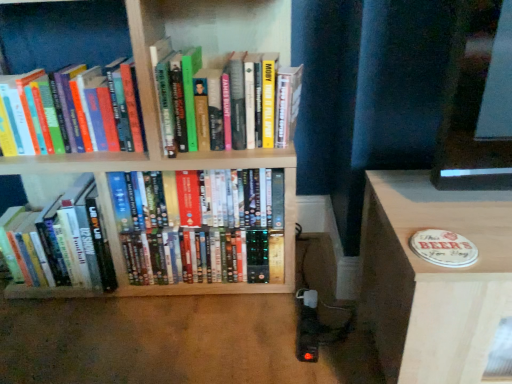
In order to face wooden bookshelf at center, should I rotate leftwards or rightwards?

It's best to rotate left around 14.934 degrees.

Identify the location of wooden coaster at lower right. Image resolution: width=512 pixels, height=384 pixels. (433, 278).

Measure the distance between hardcover books at center, acting as the fourth book starting from the left, and camera.

hardcover books at center, acting as the fourth book starting from the left, is 3.35 feet from camera.

Describe the element at coordinates (60, 242) in the screenshot. Image resolution: width=512 pixels, height=384 pixels. I see `hardcover books at left, acting as the 4th book starting from the right` at that location.

Locate an element on the screen. Image resolution: width=512 pixels, height=384 pixels. wooden bookshelf at center is located at coordinates (159, 126).

How different are the orientations of wooden bookshelf at center and hardcover books at center, acting as the fourth book starting from the left, in degrees?

There is a 0.00281-degree angle between the facing directions of wooden bookshelf at center and hardcover books at center, acting as the fourth book starting from the left.

From the image's perspective, which one is positioned higher, wooden bookshelf at center or hardcover books at center, acting as the fourth book starting from the left?

hardcover books at center, acting as the fourth book starting from the left, appears higher in the image.

Is point (210, 161) positioned before point (271, 118)?

Yes, it is.

Considering the sizes of objects wooden bookshelf at center and hardcover books at center, arranged as the 1th book when viewed from the right, in the image provided, who is wider, wooden bookshelf at center or hardcover books at center, arranged as the 1th book when viewed from the right,?

With larger width is wooden bookshelf at center.

From a real-world perspective, which is physically below, wooden bookshelf at center or wooden coaster at lower right?

From a 3D spatial view, wooden coaster at lower right is below.

Between point (178, 36) and point (448, 340), which one is positioned in front?

The point (448, 340) is more forward.

Between wooden bookshelf at center and wooden coaster at lower right, which one appears on the right side from the viewer's perspective?

From the viewer's perspective, wooden coaster at lower right appears more on the right side.

Choose the correct answer: Is wooden bookshelf at center inside wooden coaster at lower right or outside it?

The correct answer is: outside.

Where is `bookcase above the hardcover books at center, the 2th book in the right-to-left sequence (from the image's perspective)`? bookcase above the hardcover books at center, the 2th book in the right-to-left sequence (from the image's perspective) is located at coordinates (159, 126).

Based on their sizes in the image, would you say wooden bookshelf at center is bigger or smaller than hardcover books at center, the 2th book in the right-to-left sequence?

Considering their sizes, wooden bookshelf at center takes up more space than hardcover books at center, the 2th book in the right-to-left sequence.

Which of these two, wooden bookshelf at center or hardcover books at center, the 2th book in the right-to-left sequence, is wider?

wooden bookshelf at center.

Is wooden bookshelf at center oriented towards hardcover books at center, arranged as the 3th book when viewed from the left?

Yes, wooden bookshelf at center is facing hardcover books at center, arranged as the 3th book when viewed from the left.

Consider the image. Which is more to the right, hardcover books at center, arranged as the 1th book when viewed from the right, or wooden coaster at lower right?

Positioned to the right is wooden coaster at lower right.

Is hardcover books at center, acting as the fourth book starting from the left, taller or shorter than wooden coaster at lower right?

Clearly, hardcover books at center, acting as the fourth book starting from the left, is shorter compared to wooden coaster at lower right.

Which is behind, point (260, 124) or point (431, 378)?

The point (260, 124) is behind.

Identify the location of bookcase below the hardcover book at upper left, the third book in the right-to-left sequence (from the image's perspective). (159, 126).

From the image's perspective, is wooden bookshelf at center beneath hardcover book at upper left, the third book in the right-to-left sequence?

Yes.

Considering the relative positions of wooden bookshelf at center and hardcover book at upper left, the third book in the right-to-left sequence, in the image provided, is wooden bookshelf at center behind hardcover book at upper left, the third book in the right-to-left sequence,?

No.

From their relative heights in the image, would you say wooden bookshelf at center is taller or shorter than hardcover book at upper left, the second book positioned from the left?

wooden bookshelf at center is taller than hardcover book at upper left, the second book positioned from the left.

Looking at this image, considering the relative sizes of hardcover books at left, acting as the 4th book starting from the right, and hardcover books at center, arranged as the 3th book when viewed from the left, in the image provided, is hardcover books at left, acting as the 4th book starting from the right, thinner than hardcover books at center, arranged as the 3th book when viewed from the left,?

Yes.

Based on their positions, is hardcover books at left, the first book viewed from the left, located to the left or right of hardcover books at center, arranged as the 3th book when viewed from the left?

Clearly, hardcover books at left, the first book viewed from the left, is on the left of hardcover books at center, arranged as the 3th book when viewed from the left, in the image.

Is point (75, 224) positioned after point (211, 253)?

No, it is in front of (211, 253).

Considering the sizes of objects hardcover books at left, acting as the 4th book starting from the right, and hardcover books at center, arranged as the 3th book when viewed from the left, in the image provided, who is bigger, hardcover books at left, acting as the 4th book starting from the right, or hardcover books at center, arranged as the 3th book when viewed from the left,?

Bigger between the two is hardcover books at center, arranged as the 3th book when viewed from the left.

Consider the image. Is hardcover books at center, the 2th book in the right-to-left sequence, positioned beyond the bounds of wooden coaster at lower right?

hardcover books at center, the 2th book in the right-to-left sequence, is positioned outside wooden coaster at lower right.

Which is more to the right, hardcover books at center, arranged as the 3th book when viewed from the left, or wooden coaster at lower right?

wooden coaster at lower right.

How different are the orientations of hardcover books at center, arranged as the 3th book when viewed from the left, and wooden coaster at lower right in degrees?

There is a 0.928-degree angle between the facing directions of hardcover books at center, arranged as the 3th book when viewed from the left, and wooden coaster at lower right.

The image size is (512, 384). What are the coordinates of `bookcase that appears below the hardcover books at center, arranged as the 1th book when viewed from the right (from a real-world perspective)` in the screenshot? It's located at (159, 126).

The height and width of the screenshot is (384, 512). Find the location of `bookcase behind the wooden coaster at lower right`. bookcase behind the wooden coaster at lower right is located at coordinates (159, 126).

Which object lies further to the anchor point hardcover books at left, acting as the 4th book starting from the right, hardcover books at center, arranged as the 1th book when viewed from the right, or hardcover book at upper left, the third book in the right-to-left sequence?

hardcover books at center, arranged as the 1th book when viewed from the right, is positioned further to the anchor hardcover books at left, acting as the 4th book starting from the right.

Consider the image. When comparing their distances from wooden coaster at lower right, does hardcover books at center, acting as the fourth book starting from the left, or hardcover book at upper left, the second book positioned from the left, seem closer?

The object closer to wooden coaster at lower right is hardcover books at center, acting as the fourth book starting from the left.

Looking at the image, which one is located closer to hardcover books at left, acting as the 4th book starting from the right, wooden coaster at lower right or hardcover books at center, arranged as the 1th book when viewed from the right?

hardcover books at center, arranged as the 1th book when viewed from the right.

Based on their spatial positions, is hardcover book at upper left, the second book positioned from the left, or hardcover books at center, acting as the fourth book starting from the left, closer to hardcover books at left, the first book viewed from the left?

hardcover book at upper left, the second book positioned from the left.

When comparing their distances from hardcover books at center, arranged as the 3th book when viewed from the left, does hardcover book at upper left, the third book in the right-to-left sequence, or wooden coaster at lower right seem further?

wooden coaster at lower right is positioned further to the anchor hardcover books at center, arranged as the 3th book when viewed from the left.

From the image, which object appears to be nearer to wooden coaster at lower right, wooden bookshelf at center or hardcover books at center, acting as the fourth book starting from the left?

hardcover books at center, acting as the fourth book starting from the left, is positioned closer to the anchor wooden coaster at lower right.

Looking at the image, which one is located further to wooden bookshelf at center, hardcover books at center, the 2th book in the right-to-left sequence, or hardcover books at left, acting as the 4th book starting from the right?

Among the two, hardcover books at left, acting as the 4th book starting from the right, is located further to wooden bookshelf at center.

Which object lies further to the anchor point hardcover books at left, the first book viewed from the left, hardcover books at center, arranged as the 3th book when viewed from the left, or wooden coaster at lower right?

wooden coaster at lower right is positioned further to the anchor hardcover books at left, the first book viewed from the left.

At what (x,y) coordinates should I click in order to perform the action: click on book situated between hardcover books at left, acting as the 4th book starting from the right, and hardcover books at center, the 2th book in the right-to-left sequence, from left to right. Please return your answer as a coordinate pair (x, y). The image size is (512, 384). Looking at the image, I should click on (32, 119).

You are a GUI agent. You are given a task and a screenshot of the screen. Output one action in this format:
    pyautogui.click(x=<x>, y=<y>)
    Task: Click on the bookcase between hardcover book at upper left, the second book positioned from the left, and hardcover books at center, the 2th book in the right-to-left sequence
    The image size is (512, 384).
    Given the screenshot: What is the action you would take?
    pyautogui.click(x=159, y=126)

Identify the location of bookcase between hardcover books at left, acting as the 4th book starting from the right, and wooden coaster at lower right, in the horizontal direction. This screenshot has width=512, height=384. (159, 126).

Identify the location of book between hardcover book at upper left, the third book in the right-to-left sequence, and hardcover books at center, acting as the fourth book starting from the left, in the horizontal direction. The height and width of the screenshot is (384, 512). (210, 249).